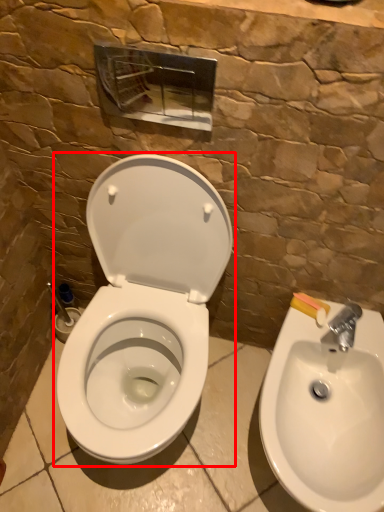
Question: From the image's perspective, where is toilet (annotated by the red box) located in relation to sink in the image?

Choices:
 (A) below
 (B) above

Answer: (B)